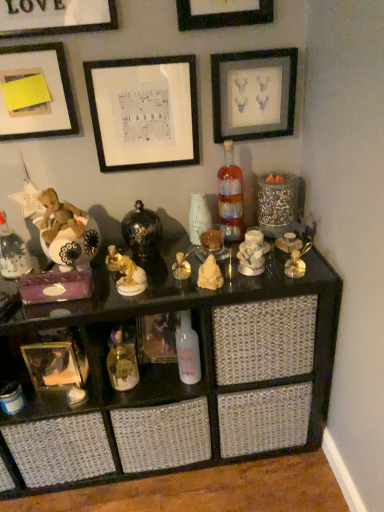
What is the approximate width of white glossy vase at center?

white glossy vase at center is 2.67 inches wide.

Describe the element at coordinates (210, 274) in the screenshot. This screenshot has width=384, height=512. I see `matte yellow figurine at center, acting as the fourth toy starting from the left` at that location.

Find the location of a particular element. Image resolution: width=384 pixels, height=512 pixels. gold metallic toy at lower center, the 1th toy from the left is located at coordinates (122, 362).

Image resolution: width=384 pixels, height=512 pixels. Describe the element at coordinates (188, 351) in the screenshot. I see `white glossy bottle at center, which ranks as the second bottle in left-to-right order` at that location.

The width and height of the screenshot is (384, 512). Find the location of `white glossy bottle at center, arranged as the second bottle when viewed from the right`. white glossy bottle at center, arranged as the second bottle when viewed from the right is located at coordinates (188, 351).

The height and width of the screenshot is (512, 384). I want to click on white glossy vase at center, so click(x=198, y=217).

Between porcelain figurine at center, the 1th toy when ordered from right to left, and gold metallic figurine at center, which appears as the 4th toy when viewed from the right, which one has less height?

With less height is gold metallic figurine at center, which appears as the 4th toy when viewed from the right.

Image resolution: width=384 pixels, height=512 pixels. In order to click on the 3rd toy above when counting from the gold metallic figurine at center, the second toy from the left (from the image's perspective) in this screenshot , I will do `click(252, 254)`.

Is the position of porcelain figurine at center, the 1th toy when ordered from right to left, less distant than that of gold metallic figurine at center, which appears as the 4th toy when viewed from the right?

No, porcelain figurine at center, the 1th toy when ordered from right to left, is further to the viewer.

How many degrees apart are the facing directions of porcelain figurine at center, the 1th toy when ordered from right to left, and gold metallic figurine at center, which appears as the 4th toy when viewed from the right?

porcelain figurine at center, the 1th toy when ordered from right to left, and gold metallic figurine at center, which appears as the 4th toy when viewed from the right, are facing 20.5 degrees away from each other.

Does gold metallic toy at lower center, the fifth toy positioned from the right, touch black glossy shelf at center?

No.

Which is less distant, (112, 333) or (283, 432)?

Clearly, point (112, 333) is closer to the camera than point (283, 432).

Considering the relative sizes of gold metallic toy at lower center, the fifth toy positioned from the right, and black glossy shelf at center in the image provided, is gold metallic toy at lower center, the fifth toy positioned from the right, bigger than black glossy shelf at center?

Actually, gold metallic toy at lower center, the fifth toy positioned from the right, might be smaller than black glossy shelf at center.

Is gold metallic toy at lower center, the fifth toy positioned from the right, oriented towards black glossy shelf at center?

Yes, gold metallic toy at lower center, the fifth toy positioned from the right, faces towards black glossy shelf at center.

Looking at this image, between white matte picture frame at upper left, which is the 5th picture frame in bottom-to-top order, and gold metallic figurine at center, which appears as the 4th toy when viewed from the right, which one has larger width?

Wider between the two is gold metallic figurine at center, which appears as the 4th toy when viewed from the right.

From the picture: Is gold metallic figurine at center, which appears as the 4th toy when viewed from the right, a part of white matte picture frame at upper left, arranged as the second picture frame when viewed from the top?

Actually, gold metallic figurine at center, which appears as the 4th toy when viewed from the right, is outside white matte picture frame at upper left, arranged as the second picture frame when viewed from the top.

From the picture: Considering the sizes of objects white matte picture frame at upper left, which is the 5th picture frame in bottom-to-top order, and gold metallic figurine at center, which appears as the 4th toy when viewed from the right, in the image provided, who is shorter, white matte picture frame at upper left, which is the 5th picture frame in bottom-to-top order, or gold metallic figurine at center, which appears as the 4th toy when viewed from the right,?

Standing shorter between the two is gold metallic figurine at center, which appears as the 4th toy when viewed from the right.

From the image's perspective, who appears lower, white matte picture frame at upper left, which is the 5th picture frame in bottom-to-top order, or gold metallic figurine at center, the second toy from the left?

gold metallic figurine at center, the second toy from the left, appears lower in the image.

Consider the image. Is white glossy vase at center smaller than black glossy shelf at center?

Correct, white glossy vase at center occupies less space than black glossy shelf at center.

In the image, is white glossy vase at center on the left side or the right side of black glossy shelf at center?

white glossy vase at center is to the right of black glossy shelf at center.

From a real-world perspective, between white glossy vase at center and black glossy shelf at center, who is vertically higher?

From a 3D spatial view, white glossy vase at center is above.

From the image's perspective, between white glossy vase at center and black glossy shelf at center, who is located below?

From the image's view, black glossy shelf at center is below.

Is translucent glass bottle at center, the first bottle viewed from the right, not inside white glossy bottle at center, the first bottle when ordered from bottom to top?

Absolutely, translucent glass bottle at center, the first bottle viewed from the right, is external to white glossy bottle at center, the first bottle when ordered from bottom to top.

From a real-world perspective, who is located lower, translucent glass bottle at center, which is the third bottle in bottom-to-top order, or white glossy bottle at center, which ranks as the second bottle in left-to-right order?

white glossy bottle at center, which ranks as the second bottle in left-to-right order, from a real-world perspective.

Considering the relative sizes of translucent glass bottle at center, which is the third bottle in bottom-to-top order, and white glossy bottle at center, which ranks as the 3th bottle in top-to-bottom order, in the image provided, is translucent glass bottle at center, which is the third bottle in bottom-to-top order, wider than white glossy bottle at center, which ranks as the 3th bottle in top-to-bottom order,?

Correct, the width of translucent glass bottle at center, which is the third bottle in bottom-to-top order, exceeds that of white glossy bottle at center, which ranks as the 3th bottle in top-to-bottom order.

Is translucent glass bottle at center, the first bottle viewed from the right, positioned with its back to white glossy bottle at center, arranged as the second bottle when viewed from the right?

No, translucent glass bottle at center, the first bottle viewed from the right, is not facing away from white glossy bottle at center, arranged as the second bottle when viewed from the right.

Is matte yellow figurine at center, acting as the fourth toy starting from the left, not within white glossy bottle at center, arranged as the second bottle when viewed from the right?

Yes.

Considering the sizes of objects matte yellow figurine at center, acting as the fourth toy starting from the left, and white glossy bottle at center, the first bottle when ordered from bottom to top, in the image provided, who is bigger, matte yellow figurine at center, acting as the fourth toy starting from the left, or white glossy bottle at center, the first bottle when ordered from bottom to top,?

Bigger between the two is white glossy bottle at center, the first bottle when ordered from bottom to top.

Considering the sizes of objects matte yellow figurine at center, acting as the fourth toy starting from the left, and white glossy bottle at center, which ranks as the second bottle in left-to-right order, in the image provided, who is wider, matte yellow figurine at center, acting as the fourth toy starting from the left, or white glossy bottle at center, which ranks as the second bottle in left-to-right order,?

With larger width is white glossy bottle at center, which ranks as the second bottle in left-to-right order.

Which object is further away from the camera taking this photo, matte yellow figurine at center, the 2th toy viewed from the right, or white glossy bottle at center, arranged as the second bottle when viewed from the right?

Positioned behind is white glossy bottle at center, arranged as the second bottle when viewed from the right.

What's the angular difference between yellow paper at upper left, acting as the third picture frame starting from the bottom, and translucent glass bottle at center, which is the third bottle in bottom-to-top order,'s facing directions?

yellow paper at upper left, acting as the third picture frame starting from the bottom, and translucent glass bottle at center, which is the third bottle in bottom-to-top order, are facing 27.9 degrees away from each other.

Is yellow paper at upper left, acting as the third picture frame starting from the bottom, shorter than translucent glass bottle at center, marked as the 3th bottle in a left-to-right arrangement?

Indeed, yellow paper at upper left, acting as the third picture frame starting from the bottom, has a lesser height compared to translucent glass bottle at center, marked as the 3th bottle in a left-to-right arrangement.

Is yellow paper at upper left, acting as the third picture frame starting from the bottom, looking in the opposite direction of translucent glass bottle at center, marked as the 3th bottle in a left-to-right arrangement?

No.

Would you say yellow paper at upper left, acting as the third picture frame starting from the bottom, is a long distance from translucent glass bottle at center, which appears as the first bottle when viewed from the top?

No.

The height and width of the screenshot is (512, 384). Identify the location of toy that is the 1st one below the gold metallic figurine at center, the second toy from the left (from a real-world perspective). (252, 254).

I want to click on shelf on the right of gold metallic toy at lower center, the 1th toy from the left, so click(x=178, y=378).

When comparing their distances from white matte picture frame at upper left, which is the 5th picture frame in bottom-to-top order, does gold metallic toy at lower center, the fifth toy positioned from the right, or porcelain figurine at center, the 1th toy when ordered from right to left, seem further?

Based on the image, gold metallic toy at lower center, the fifth toy positioned from the right, appears to be further to white matte picture frame at upper left, which is the 5th picture frame in bottom-to-top order.

Estimate the real-world distances between objects in this image. Which object is closer to matte yellow figurine at center, acting as the fourth toy starting from the left, gold metallic perfume bottle at center, which ranks as the third toy in right-to-left order, or matte gray picture frame at upper right, acting as the third picture frame starting from the top?

The object closer to matte yellow figurine at center, acting as the fourth toy starting from the left, is gold metallic perfume bottle at center, which ranks as the third toy in right-to-left order.

Which object lies nearer to the anchor point porcelain figurine at center, the 1th toy when ordered from right to left, translucent glass bottle at center, the first bottle viewed from the right, or yellow paper at upper left, which is the fourth picture frame from top to bottom?

Among the two, translucent glass bottle at center, the first bottle viewed from the right, is located nearer to porcelain figurine at center, the 1th toy when ordered from right to left.

Estimate the real-world distances between objects in this image. Which object is closer to black glossy shelf at center, gold metallic toy at lower center, the 1th toy from the left, or porcelain figurine at center, which is the 5th toy in left-to-right order?

Based on the image, gold metallic toy at lower center, the 1th toy from the left, appears to be nearer to black glossy shelf at center.

Estimate the real-world distances between objects in this image. Which object is further from white paper at upper center, which is counted as the second picture frame, starting from the bottom, white glossy vase at center or matte gray picture frame at upper right, marked as the fourth picture frame in a bottom-to-top arrangement?

white glossy vase at center.

Estimate the real-world distances between objects in this image. Which object is further from matte black bottle at left, the first bottle when ordered from left to right, gold metallic toy at lower center, the 1th toy from the left, or translucent glass bottle at center, which appears as the first bottle when viewed from the top?

translucent glass bottle at center, which appears as the first bottle when viewed from the top, is further to matte black bottle at left, the first bottle when ordered from left to right.

Considering their positions, is black glossy shelf at center positioned further to matte yellow figurine at center, the 2th toy viewed from the right, than translucent glass bottle at center, marked as the 3th bottle in a left-to-right arrangement?

black glossy shelf at center is further to matte yellow figurine at center, the 2th toy viewed from the right.

Which object lies further to the anchor point black matte picture frame at upper center, placed as the 6th picture frame when sorted from bottom to top, translucent glass bottle at center, marked as the 3th bottle in a left-to-right arrangement, or matte yellow figurine at center, the 2th toy viewed from the right?

Among the two, matte yellow figurine at center, the 2th toy viewed from the right, is located further to black matte picture frame at upper center, placed as the 6th picture frame when sorted from bottom to top.

Where is `glass vase that lies between white paper at upper center, which is counted as the second picture frame, starting from the bottom, and white glossy bottle at center, arranged as the second bottle when viewed from the right, from top to bottom`? This screenshot has height=512, width=384. glass vase that lies between white paper at upper center, which is counted as the second picture frame, starting from the bottom, and white glossy bottle at center, arranged as the second bottle when viewed from the right, from top to bottom is located at coordinates (198, 217).

This screenshot has height=512, width=384. What are the coordinates of `bottle situated between matte black bottle at left, the third bottle viewed from the right, and translucent glass bottle at center, which appears as the first bottle when viewed from the top, from left to right` in the screenshot? It's located at (188, 351).

The width and height of the screenshot is (384, 512). I want to click on glass vase situated between gold metallic picture frame at lower left, the 1th picture frame ordered from the bottom, and matte yellow figurine at center, the 2th toy viewed from the right, from left to right, so click(198, 217).

The image size is (384, 512). What are the coordinates of `picture frame between white paper at upper center, which is counted as the fifth picture frame, starting from the top, and gold metallic toy at lower center, the 1th toy from the left, in the up-down direction` in the screenshot? It's located at (55, 365).